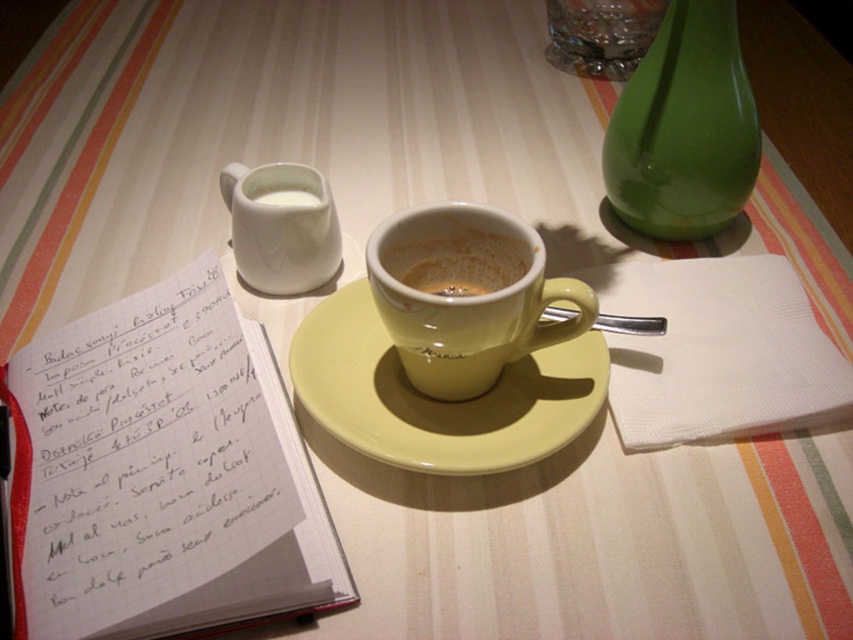
Question: Is the position of yellow glossy saucer at center more distant than that of matte ceramic mug at center?

Choices:
 (A) yes
 (B) no

Answer: (A)

Question: Estimate the real-world distances between objects in this image. Which object is closer to the white matte creamer at upper left?

Choices:
 (A) white paper napkin at upper right
 (B) matte ceramic mug at center
 (C) red cover notebook at left
 (D) yellow glossy saucer at center

Answer: (B)

Question: Which object is farther from the camera taking this photo?

Choices:
 (A) red cover notebook at left
 (B) white paper napkin at upper right

Answer: (B)

Question: Does matte ceramic mug at center have a greater width compared to white glossy mug at upper center?

Choices:
 (A) no
 (B) yes

Answer: (B)

Question: Which object is the farthest from the red cover notebook at left?

Choices:
 (A) white matte creamer at upper left
 (B) yellow ceramic cup at center
 (C) matte ceramic mug at center
 (D) yellow glossy saucer at center

Answer: (A)

Question: Does yellow ceramic cup at center appear on the left side of white matte creamer at upper left?

Choices:
 (A) yes
 (B) no

Answer: (B)